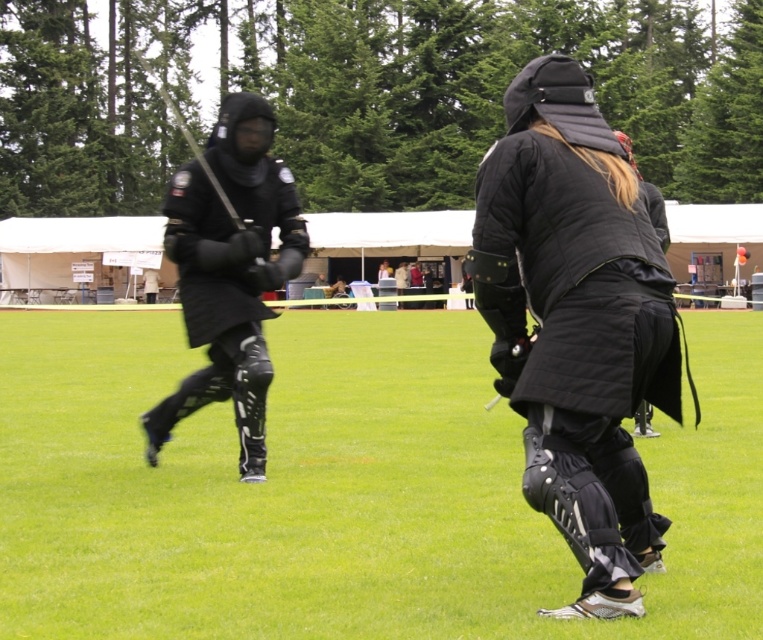
Does black matte knee pads at center have a lesser height compared to matte black jacket at center?

Yes.

Does black matte knee pads at center lie in front of matte black jacket at center?

Yes, it is.

Locate an element on the screen. black matte knee pads at center is located at coordinates (343, 488).

Is black matte knee pads at center further to camera compared to matte black armor at left?

No, it is in front of matte black armor at left.

Which is more to the left, black matte knee pads at center or matte black armor at left?

From the viewer's perspective, matte black armor at left appears more on the left side.

Locate an element on the screen. The height and width of the screenshot is (640, 763). black matte knee pads at center is located at coordinates (343, 488).

Find the location of a particular element. The image size is (763, 640). black matte knee pads at center is located at coordinates (343, 488).

Describe the element at coordinates (229, 272) in the screenshot. This screenshot has height=640, width=763. I see `matte black armor at left` at that location.

Where is `matte black armor at left`? This screenshot has height=640, width=763. matte black armor at left is located at coordinates (229, 272).